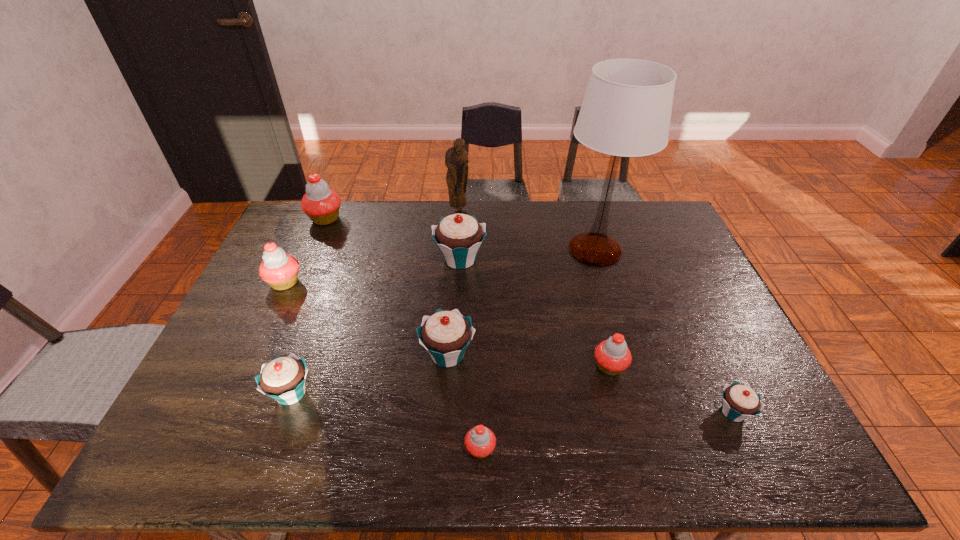
I want to click on blank space located 0.220m on the back of the rightmost red cupcake, so click(590, 294).

At what (x,y) coordinates should I click in order to perform the action: click on vacant region located 0.260m on the right of the second smallest teal cupcake. Please return your answer as a coordinate pair (x, y). This screenshot has width=960, height=540. Looking at the image, I should click on (421, 393).

The image size is (960, 540). Find the location of `free location located on the back of the rightmost teal cupcake`. free location located on the back of the rightmost teal cupcake is located at coordinates (690, 319).

Locate an element on the screen. free point located 0.190m on the back of the smallest red cupcake is located at coordinates (480, 365).

Where is `table lamp positioned at the far edge`? table lamp positioned at the far edge is located at coordinates (626, 111).

Find the location of a particular element. figurine that is positioned at the far edge is located at coordinates (456, 160).

Where is `cupcake located at the far edge`? cupcake located at the far edge is located at coordinates (321, 204).

Image resolution: width=960 pixels, height=540 pixels. I want to click on object situated at the right edge, so click(739, 401).

Identify the location of object positioned at the far left corner. The height and width of the screenshot is (540, 960). (321, 204).

Find the location of a particular element. The image size is (960, 540). object present at the near right corner is located at coordinates (739, 401).